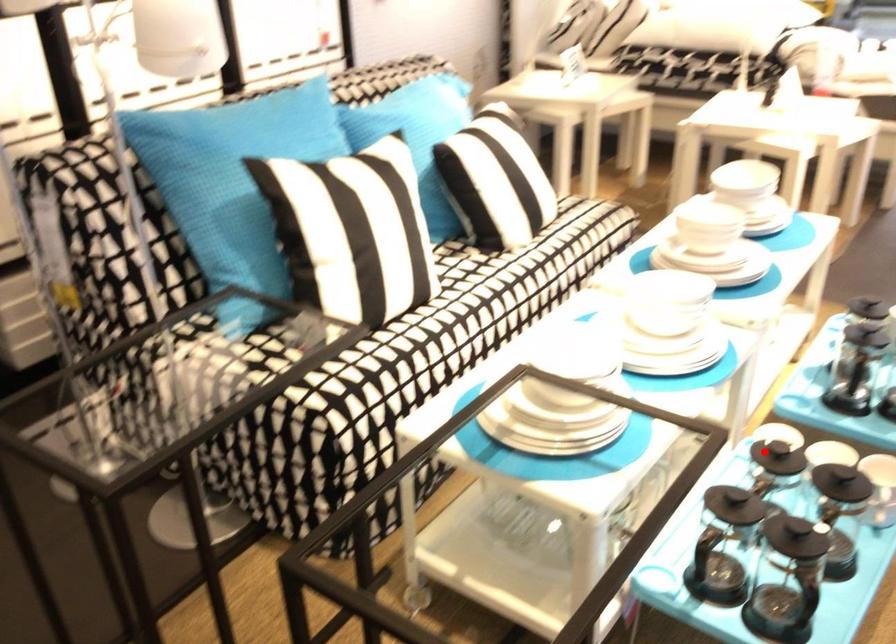
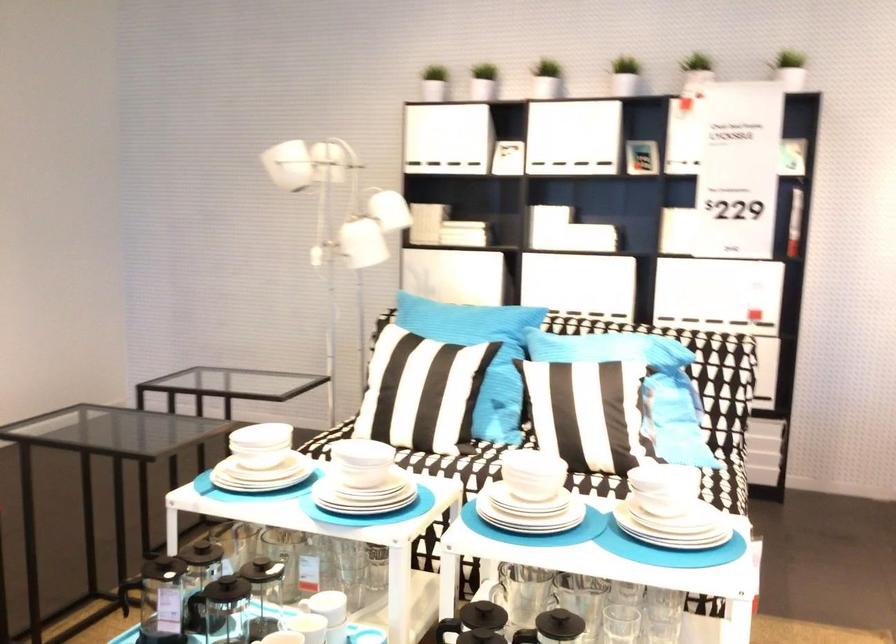
Question: A red point is marked in image1. In image2, is the corresponding 3D point closer to the camera or farther? Reply with the corresponding letter.

Choices:
 (A) The corresponding 3D point is closer.
 (B) The corresponding 3D point is farther.

Answer: (B)